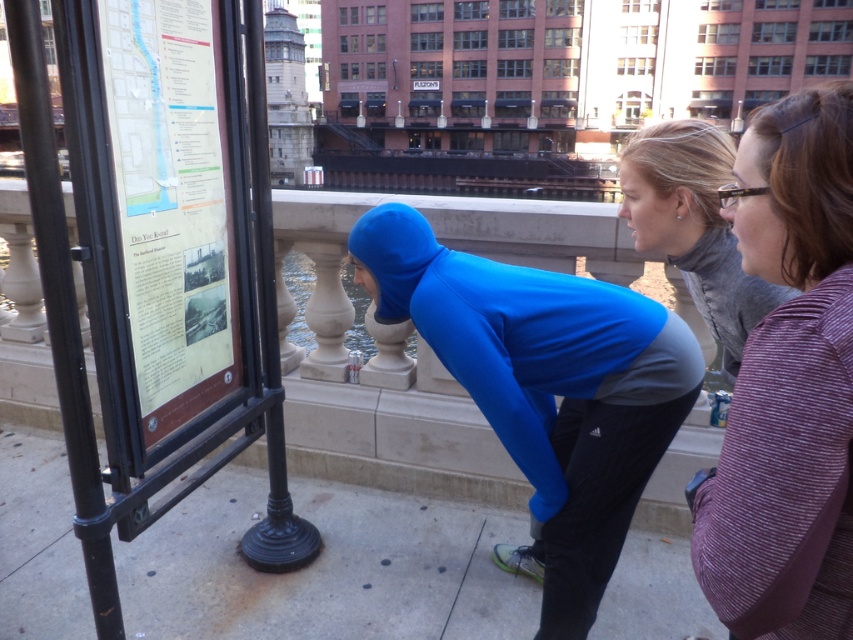
Does point (80, 637) lie behind point (146, 163)?

Yes, it is behind point (146, 163).

Can you confirm if smooth concrete pavement at center is shorter than paper map at left?

Indeed, smooth concrete pavement at center has a lesser height compared to paper map at left.

Is point (511, 627) farther from viewer compared to point (138, 179)?

Yes, point (511, 627) is farther from viewer.

You are a GUI agent. You are given a task and a screenshot of the screen. Output one action in this format:
    pyautogui.click(x=<x>, y=<y>)
    Task: Click on the smooth concrete pavement at center
    This screenshot has height=640, width=853.
    Given the screenshot: What is the action you would take?
    pyautogui.click(x=325, y=568)

Does point (426, 516) come closer to viewer compared to point (265, 244)?

No.

Does point (250, 506) come behind point (274, 305)?

Yes, it is behind point (274, 305).

I want to click on smooth concrete pavement at center, so click(x=325, y=568).

Between smooth concrete pavement at center and blue spandex squat at center, which one has less height?

With less height is smooth concrete pavement at center.

Does smooth concrete pavement at center appear over blue spandex squat at center?

Answer: No.

Is point (254, 586) positioned in front of point (432, 237)?

No, it is behind (432, 237).

At what (x,y) coordinates should I click in order to perform the action: click on smooth concrete pavement at center. Please return your answer as a coordinate pair (x, y). The width and height of the screenshot is (853, 640). Looking at the image, I should click on (325, 568).